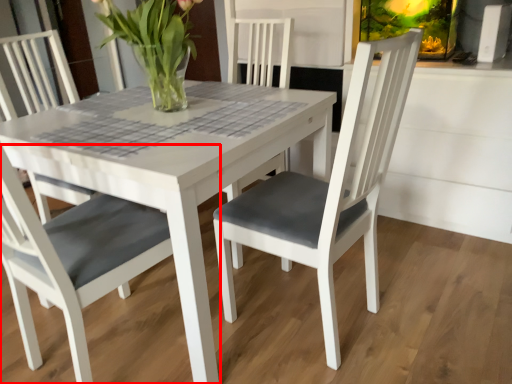
Question: Considering the relative positions of chair (annotated by the red box) and houseplant in the image provided, where is chair (annotated by the red box) located with respect to the staircase?

Choices:
 (A) left
 (B) right

Answer: (B)